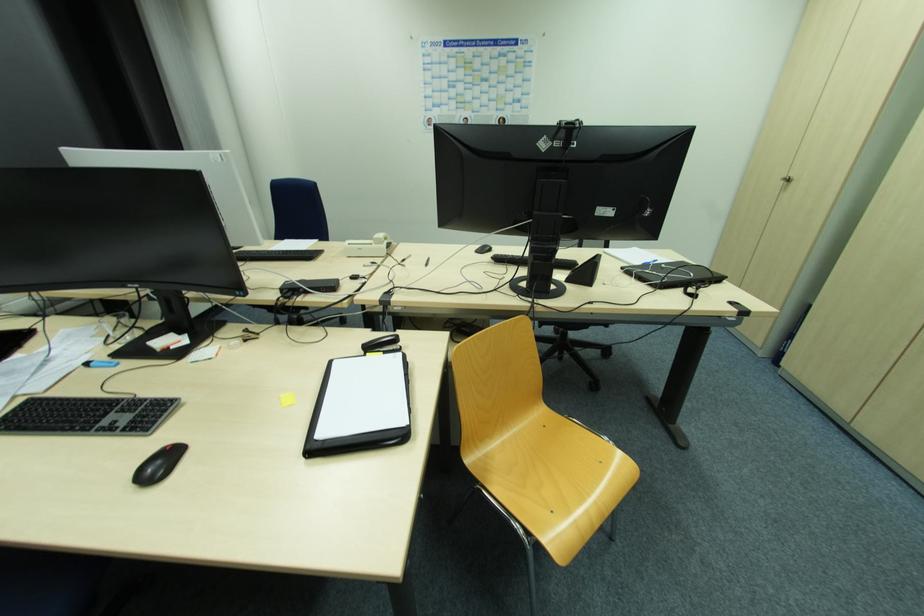
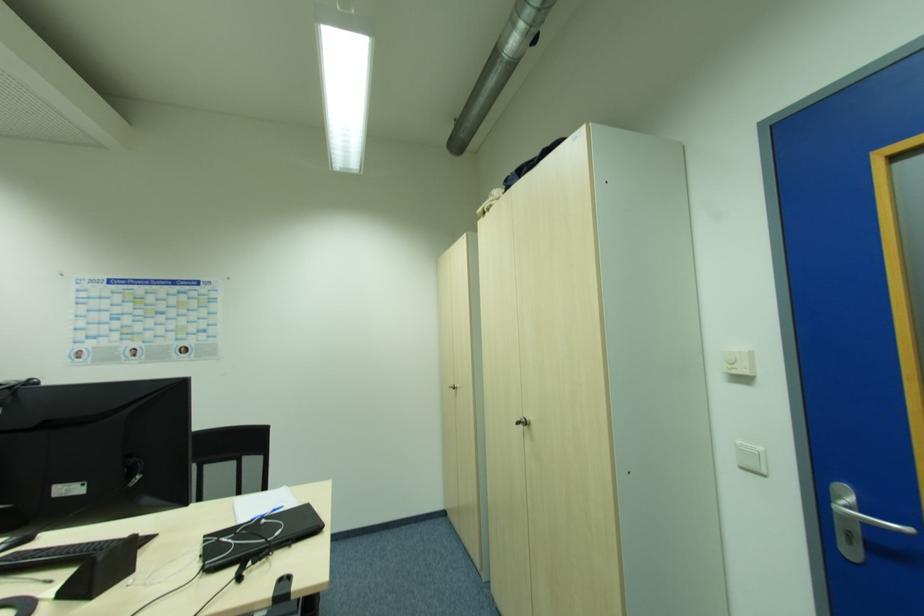
Where in the second image is the point corresponding to point (665, 267) from the first image?

(265, 521)